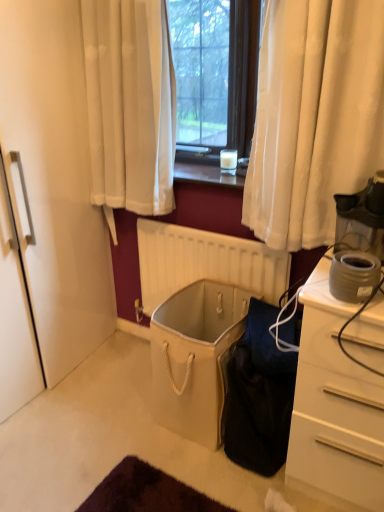
Question: From a real-world perspective, is matte gray coffee maker at right, which is the second appliance in top-to-bottom order, below black fabric bag at lower center?

Choices:
 (A) no
 (B) yes

Answer: (A)

Question: Is matte gray coffee maker at right, which is the second appliance in top-to-bottom order, not near black fabric bag at lower center?

Choices:
 (A) no
 (B) yes

Answer: (A)

Question: Can you confirm if matte gray coffee maker at right, which is the second appliance in top-to-bottom order, is wider than black fabric bag at lower center?

Choices:
 (A) no
 (B) yes

Answer: (A)

Question: Is matte gray coffee maker at right, which is counted as the 1th appliance, starting from the bottom, with black fabric bag at lower center?

Choices:
 (A) no
 (B) yes

Answer: (A)

Question: Is matte gray coffee maker at right, which is counted as the 1th appliance, starting from the bottom, oriented towards black fabric bag at lower center?

Choices:
 (A) yes
 (B) no

Answer: (B)

Question: From the image's perspective, is black fabric bag at lower center positioned above or below beige matte radiator at center?

Choices:
 (A) above
 (B) below

Answer: (B)

Question: Considering the relative positions of black fabric bag at lower center and beige matte radiator at center in the image provided, is black fabric bag at lower center to the left or to the right of beige matte radiator at center?

Choices:
 (A) right
 (B) left

Answer: (A)

Question: In terms of width, does black fabric bag at lower center look wider or thinner when compared to beige matte radiator at center?

Choices:
 (A) thin
 (B) wide

Answer: (B)

Question: From their relative heights in the image, would you say black fabric bag at lower center is taller or shorter than beige matte radiator at center?

Choices:
 (A) short
 (B) tall

Answer: (A)

Question: Considering the relative positions of translucent glass coffee cup at center and black fabric bag at lower center in the image provided, is translucent glass coffee cup at center to the left or to the right of black fabric bag at lower center?

Choices:
 (A) right
 (B) left

Answer: (B)

Question: From a real-world perspective, relative to black fabric bag at lower center, is translucent glass coffee cup at center vertically above or below?

Choices:
 (A) above
 (B) below

Answer: (A)

Question: In terms of size, does translucent glass coffee cup at center appear bigger or smaller than black fabric bag at lower center?

Choices:
 (A) small
 (B) big

Answer: (A)

Question: Does point (231, 163) appear closer or farther from the camera than point (256, 399)?

Choices:
 (A) closer
 (B) farther

Answer: (B)

Question: In terms of height, does beige fabric laundry basket at center look taller or shorter compared to translucent glass coffee cup at center?

Choices:
 (A) tall
 (B) short

Answer: (A)

Question: Considering their positions, is beige fabric laundry basket at center located in front of or behind translucent glass coffee cup at center?

Choices:
 (A) behind
 (B) front

Answer: (B)